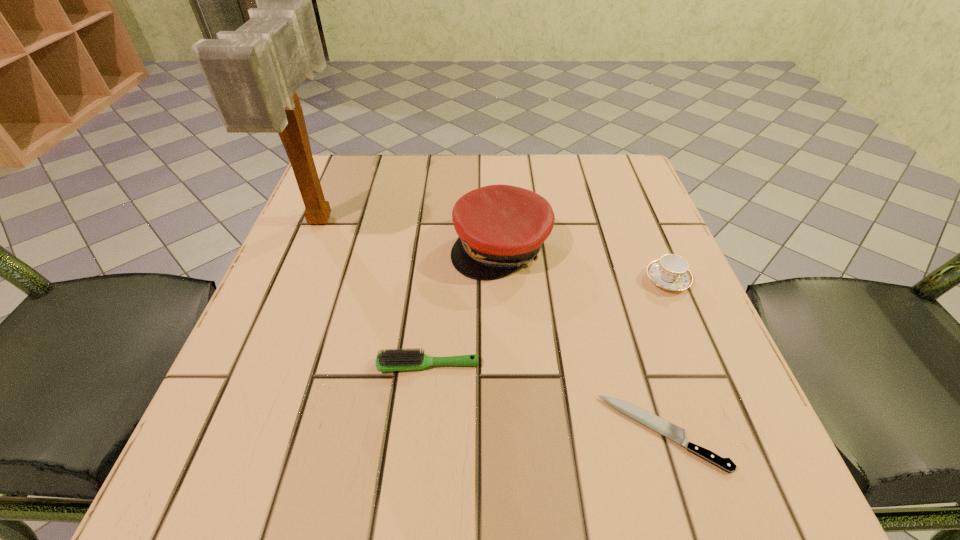
Where is `mallet`? The width and height of the screenshot is (960, 540). mallet is located at coordinates [253, 73].

Where is `the leftmost object`? The height and width of the screenshot is (540, 960). the leftmost object is located at coordinates (253, 73).

Where is `cap`? cap is located at coordinates (501, 228).

This screenshot has width=960, height=540. What are the coordinates of `the third tallest object` in the screenshot? It's located at (670, 272).

Locate an element on the screen. Image resolution: width=960 pixels, height=540 pixels. the fourth tallest object is located at coordinates (388, 360).

The image size is (960, 540). Find the location of `the fourth farthest object`. the fourth farthest object is located at coordinates (388, 360).

This screenshot has height=540, width=960. What are the coordinates of `the nearest object` in the screenshot? It's located at (652, 421).

What are the coordinates of `steak knife` in the screenshot? It's located at (652, 421).

In order to click on free region located 0.070m on the back of the mallet in this screenshot , I will do `click(344, 165)`.

This screenshot has width=960, height=540. I want to click on vacant area located 0.280m at the front of the second tallest object where the visor is located, so click(510, 427).